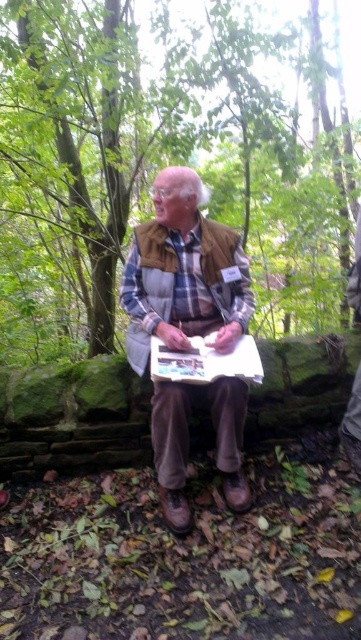
Which is behind, point (229, 387) or point (161, 372)?

Point (229, 387)

What do you see at coordinates (183, 275) in the screenshot? The image size is (361, 640). I see `brown suede vest at center` at bounding box center [183, 275].

Locate an element on the screen. brown suede vest at center is located at coordinates pyautogui.click(x=183, y=275).

Is point (220, 186) positioned after point (164, 273)?

Yes.

Who is more distant from viewer, [324,148] or [223,316]?

The point [324,148] is more distant.

The width and height of the screenshot is (361, 640). Find the location of `green leafy tree at center`. green leafy tree at center is located at coordinates (162, 160).

Which is more to the left, green leafy tree at center or white paper clipboard at center?

Positioned to the left is green leafy tree at center.

Is green leafy tree at center taller than white paper clipboard at center?

Yes, green leafy tree at center is taller than white paper clipboard at center.

At what (x,y) coordinates should I click in order to perform the action: click on green leafy tree at center. Please return your answer as a coordinate pair (x, y). Looking at the image, I should click on (162, 160).